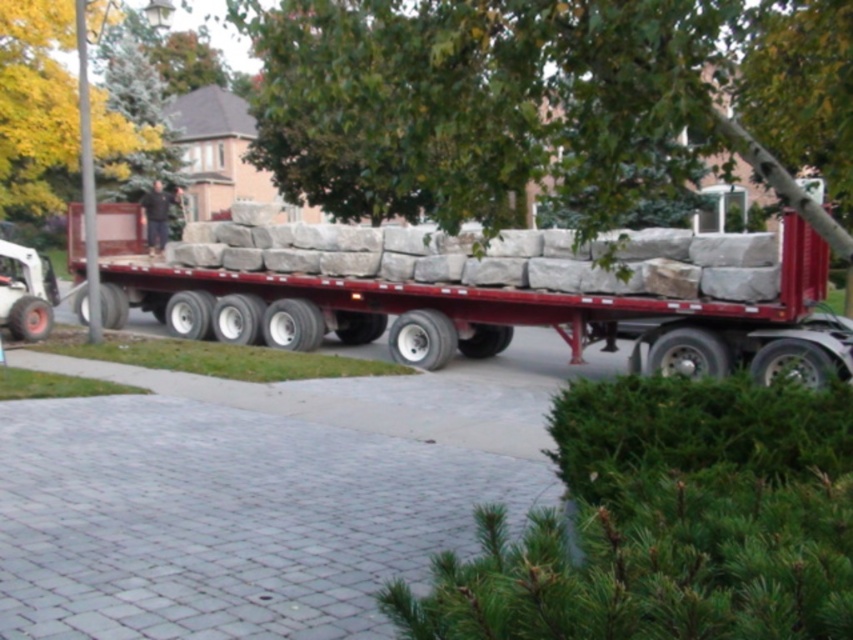
Question: Among these points, which one is nearest to the camera?

Choices:
 (A) (659, 186)
 (B) (781, 285)
 (C) (151, 221)
 (D) (22, 99)

Answer: (B)

Question: Which point appears farthest from the camera in this image?

Choices:
 (A) (22, 49)
 (B) (160, 200)
 (C) (677, 301)

Answer: (B)

Question: Is smooth gray stone at center thinner than dark brown leather jacket at center?

Choices:
 (A) yes
 (B) no

Answer: (B)

Question: Is green leafy tree at upper center closer to camera compared to dark brown leather jacket at center?

Choices:
 (A) no
 (B) yes

Answer: (B)

Question: Does green leafy tree at upper center lie in front of smooth gray stone at center?

Choices:
 (A) no
 (B) yes

Answer: (B)

Question: Which point is closer to the camera?

Choices:
 (A) (247, 20)
 (B) (22, 128)
 (C) (73, 262)

Answer: (A)